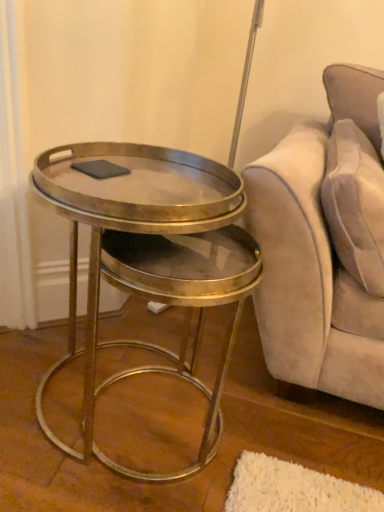
What is the approximate height of gray matte pad at center?

0.75 inches.

What do you see at coordinates (151, 259) in the screenshot? I see `metallic/goldenobject at left` at bounding box center [151, 259].

Identify the location of metallic/goldenobject at left. (151, 259).

Where is `gray matte pad at center`? Image resolution: width=384 pixels, height=512 pixels. gray matte pad at center is located at coordinates 100,169.

Considering the relative sizes of gray matte pad at center and metallic/goldenobject at left in the image provided, is gray matte pad at center smaller than metallic/goldenobject at left?

Correct, gray matte pad at center occupies less space than metallic/goldenobject at left.

Does gray matte pad at center appear on the left side of metallic/goldenobject at left?

Yes.

Is gray matte pad at center spatially inside metallic/goldenobject at left, or outside of it?

gray matte pad at center is located inside metallic/goldenobject at left.

From the image's perspective, which one is positioned lower, gray matte pad at center or metallic/goldenobject at left?

metallic/goldenobject at left is shown below in the image.

Which of these two, gray matte pad at center or suede-like beige pillow at upper right, is thinner?

Thinner between the two is gray matte pad at center.

Is gray matte pad at center located outside suede-like beige pillow at upper right?

Absolutely, gray matte pad at center is external to suede-like beige pillow at upper right.

From their relative heights in the image, would you say gray matte pad at center is taller or shorter than suede-like beige pillow at upper right?

gray matte pad at center is shorter than suede-like beige pillow at upper right.

From a real-world perspective, which object rests below the other?

→ In real-world perspective, metallic/goldenobject at left is lower.

Is the position of metallic/goldenobject at left more distant than that of suede-like beige pillow at upper right?

No, metallic/goldenobject at left is in front of suede-like beige pillow at upper right.

From the image's perspective, which is below, metallic/goldenobject at left or suede-like beige pillow at upper right?

metallic/goldenobject at left, from the image's perspective.

In the scene shown: Does metallic/goldenobject at left touch suede-like beige pillow at upper right?

There is a gap between metallic/goldenobject at left and suede-like beige pillow at upper right.

The image size is (384, 512). I want to click on pad above the metallic/goldenobject at left (from a real-world perspective), so click(100, 169).

Is metallic/goldenobject at left situated inside gray matte pad at center or outside?

metallic/goldenobject at left is not inside gray matte pad at center, it's outside.

Is metallic/goldenobject at left bigger or smaller than gray matte pad at center?

Clearly, metallic/goldenobject at left is larger in size than gray matte pad at center.

Which is more to the left, suede-like beige pillow at upper right or metallic/goldenobject at left?

metallic/goldenobject at left.

From the image's perspective, relative to metallic/goldenobject at left, is suede-like beige pillow at upper right above or below?

Based on their image positions, suede-like beige pillow at upper right is located above metallic/goldenobject at left.

From a real-world perspective, is suede-like beige pillow at upper right above or below metallic/goldenobject at left?

From a real-world perspective, suede-like beige pillow at upper right is physically above metallic/goldenobject at left.

Is point (372, 221) positioned before point (203, 167)?

Yes, point (372, 221) is closer to viewer.

In the scene shown: Is suede-like beige pillow at upper right bigger or smaller than gray matte pad at center?

Considering their sizes, suede-like beige pillow at upper right takes up more space than gray matte pad at center.

Is suede-like beige pillow at upper right oriented towards gray matte pad at center?

No, suede-like beige pillow at upper right does not turn towards gray matte pad at center.

The image size is (384, 512). Find the location of `pad on the left side of suede-like beige pillow at upper right`. pad on the left side of suede-like beige pillow at upper right is located at coordinates (100, 169).

Considering the sizes of objects suede-like beige pillow at upper right and gray matte pad at center in the image provided, who is shorter, suede-like beige pillow at upper right or gray matte pad at center?

With less height is gray matte pad at center.

Where is `table on the right of gray matte pad at center`? This screenshot has height=512, width=384. table on the right of gray matte pad at center is located at coordinates (151, 259).

Locate an element on the screen. This screenshot has height=512, width=384. pad above the suede-like beige pillow at upper right (from a real-world perspective) is located at coordinates (100, 169).

From the image, which object appears to be farther from metallic/goldenobject at left, suede-like beige pillow at upper right or gray matte pad at center?

suede-like beige pillow at upper right lies further to metallic/goldenobject at left than the other object.

From the image, which object appears to be nearer to suede-like beige pillow at upper right, gray matte pad at center or metallic/goldenobject at left?

metallic/goldenobject at left lies closer to suede-like beige pillow at upper right than the other object.

Looking at the image, which one is located further to gray matte pad at center, suede-like beige pillow at upper right or metallic/goldenobject at left?

suede-like beige pillow at upper right lies further to gray matte pad at center than the other object.

Based on their spatial positions, is gray matte pad at center or suede-like beige pillow at upper right closer to metallic/goldenobject at left?

gray matte pad at center is closer to metallic/goldenobject at left.

Estimate the real-world distances between objects in this image. Which object is further from suede-like beige pillow at upper right, metallic/goldenobject at left or gray matte pad at center?

gray matte pad at center is positioned further to the anchor suede-like beige pillow at upper right.

Considering their positions, is metallic/goldenobject at left positioned closer to gray matte pad at center than suede-like beige pillow at upper right?

Among the two, metallic/goldenobject at left is located nearer to gray matte pad at center.

Locate an element on the screen. The height and width of the screenshot is (512, 384). table between gray matte pad at center and suede-like beige pillow at upper right is located at coordinates (151, 259).